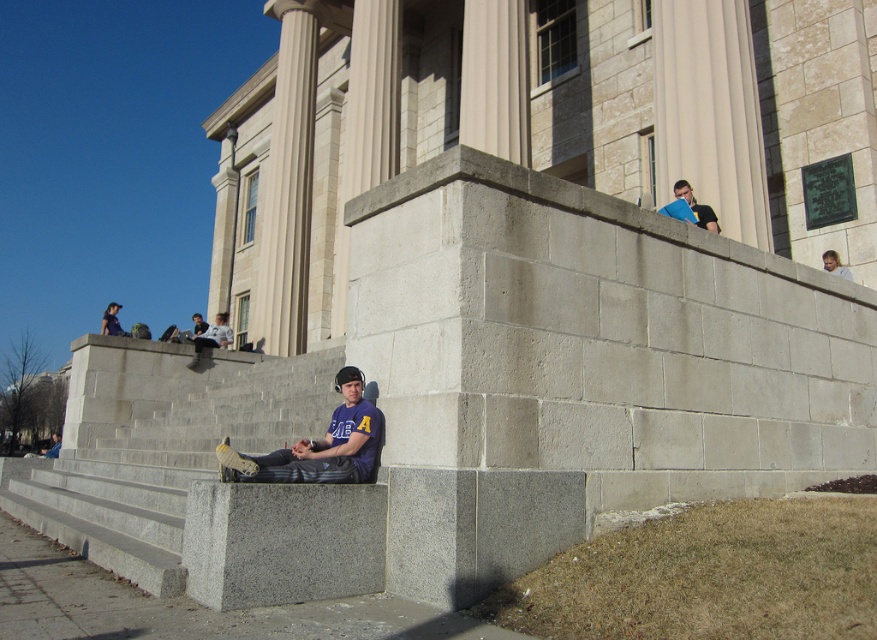
You are a photographer taking a picture of the classical building. You notice two people in the scene, one wearing a purple fabric shirt at lower center and another in a dark blue shirt at upper left. Which person should you focus on to ensure their clothing detail is captured clearly, considering their position and size?

The photographer should focus on the dark blue shirt at upper left because it has a greater width than the purple fabric shirt at lower center, making it larger and easier to capture details.